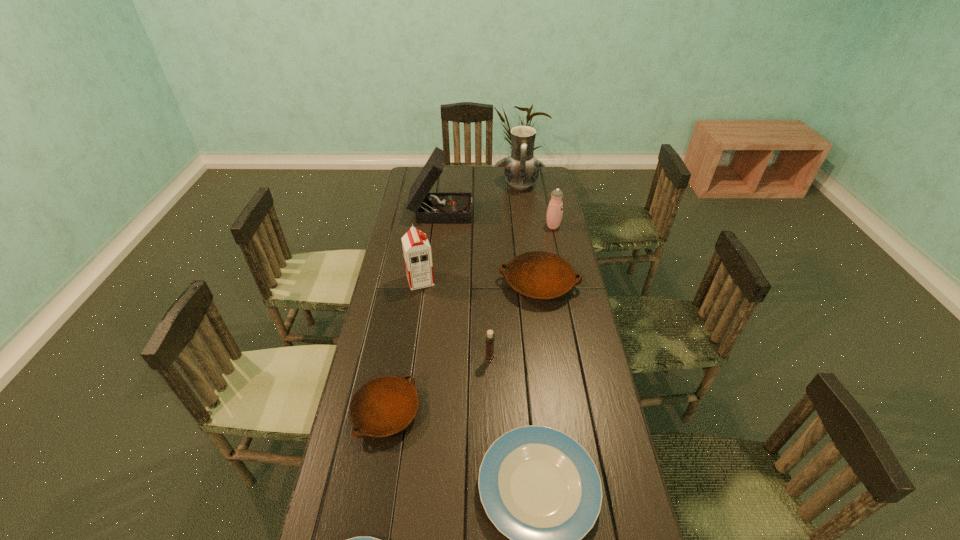
Where is `phonograph_record`? The image size is (960, 540). phonograph_record is located at coordinates pos(428,207).

Image resolution: width=960 pixels, height=540 pixels. I want to click on pitcher, so 521,170.

Locate an element on the screen. This screenshot has width=960, height=540. soya milk is located at coordinates (417, 252).

Locate an element on the screen. The image size is (960, 540). thermos bottle is located at coordinates (555, 208).

Find the location of `the fifth tallest object`. the fifth tallest object is located at coordinates (490, 336).

Identify the location of candle holder. The image size is (960, 540). (490, 336).

The height and width of the screenshot is (540, 960). Identify the location of the bigger brown plate. (539, 275).

Locate an element on the screen. Image resolution: width=960 pixels, height=540 pixels. the fourth shortest object is located at coordinates (539, 275).

The width and height of the screenshot is (960, 540). I want to click on the left brown plate, so click(383, 406).

Find the location of a particular element. The image size is (960, 540). the third shortest plate is located at coordinates (383, 406).